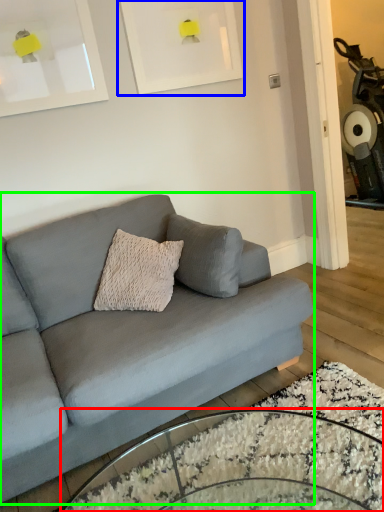
Question: Based on their relative distances, which object is farther from coffee table (highlighted by a red box)? Choose from picture frame (highlighted by a blue box) and studio couch (highlighted by a green box).

Choices:
 (A) picture frame
 (B) studio couch

Answer: (A)